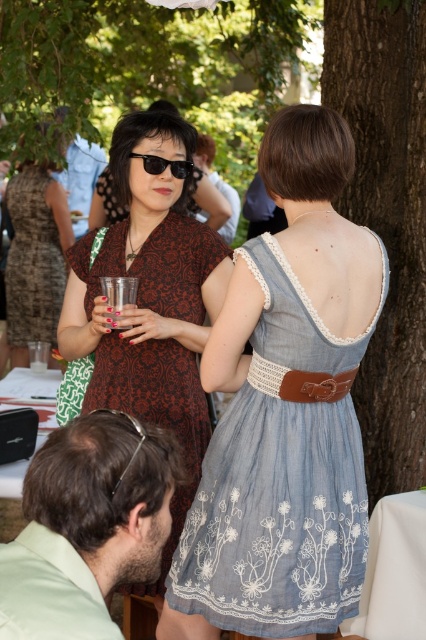
Question: Is light green shirt at lower left thinner than clear plastic goggles at center?

Choices:
 (A) yes
 (B) no

Answer: (B)

Question: Which of these objects is positioned farthest from the brown textured dress at center?

Choices:
 (A) brown textured tree trunk at right
 (B) matte brown dress at center
 (C) matte black dress at upper left
 (D) denim dress at center

Answer: (D)

Question: Which point is closer to the camera?

Choices:
 (A) (117, 301)
 (B) (72, 228)

Answer: (A)

Question: Can you confirm if light green shirt at lower left is smaller than clear plastic cup at center?

Choices:
 (A) no
 (B) yes

Answer: (A)

Question: Which of these objects is positioned closest to the clear plastic cup at center?

Choices:
 (A) matte brown dress at center
 (B) black plastic sunglasses at upper center

Answer: (A)

Question: Does matte brown dress at center have a lesser width compared to brown textured dress at center?

Choices:
 (A) no
 (B) yes

Answer: (A)